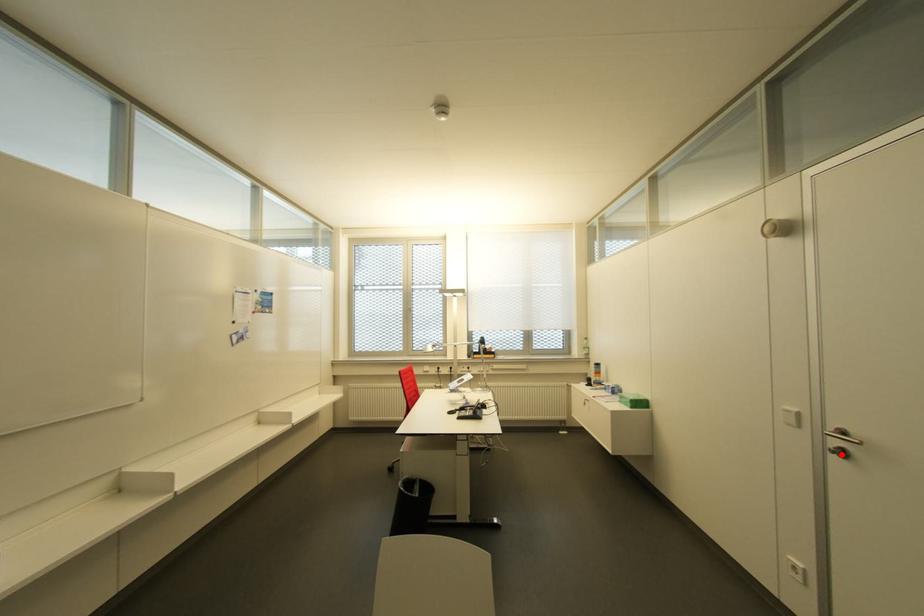
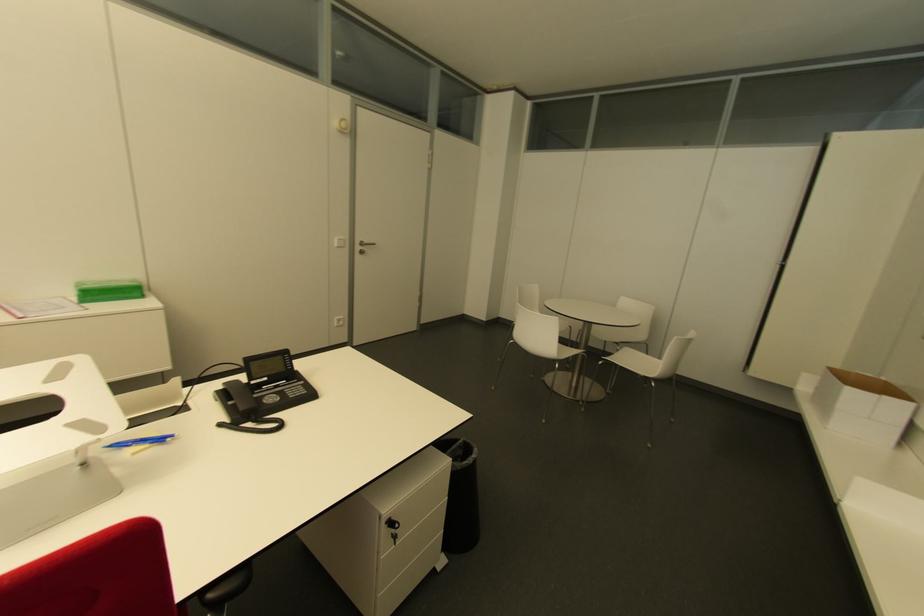
In the second image, find the point that corresponds to the highlighted location in the first image.

(360, 253)